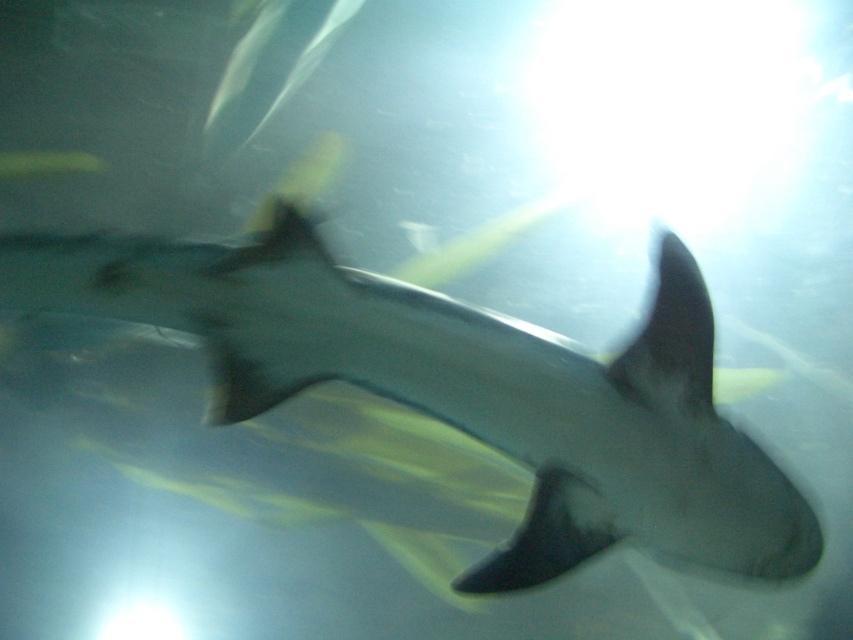
Measure the distance between gray matte shark at center and black matte fin at upper center.

The distance of gray matte shark at center from black matte fin at upper center is 7.63 inches.

Does point (7, 241) come closer to viewer compared to point (635, 400)?

Yes, it is.

Who is more distant from viewer, (65, 250) or (706, 397)?

Point (706, 397)

Identify the location of gray matte shark at center. This screenshot has width=853, height=640. (463, 388).